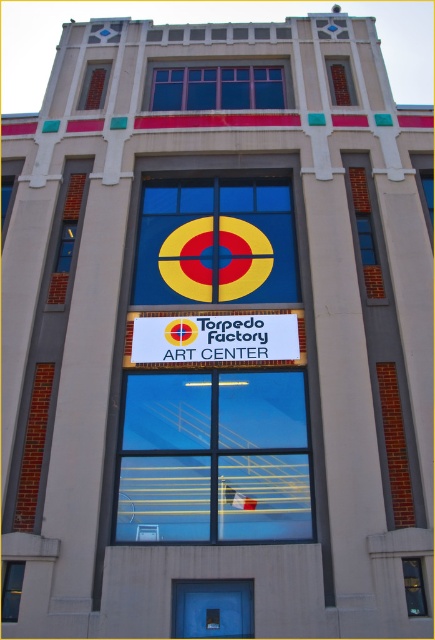
Question: Which point is closer to the camera taking this photo?

Choices:
 (A) (230, 588)
 (B) (274, 99)

Answer: (A)

Question: Which point is farther to the camera?

Choices:
 (A) transparent glass window at lower center
 (B) clear glass window at center
 (C) transparent glass window at lower left

Answer: (B)

Question: Can you confirm if white plastic sign at center is wider than transparent glass window at lower left?

Choices:
 (A) no
 (B) yes

Answer: (B)

Question: Which of the following is the closest to the observer?

Choices:
 (A) transparent glass window at lower left
 (B) white plastic sign at center
 (C) transparent glass window at lower center
 (D) clear glass window at left

Answer: (A)

Question: Does blue glass window at upper center have a smaller size compared to transparent glass window at lower center?

Choices:
 (A) no
 (B) yes

Answer: (A)

Question: Is clear glass window at center smaller than clear glass window at left?

Choices:
 (A) no
 (B) yes

Answer: (A)